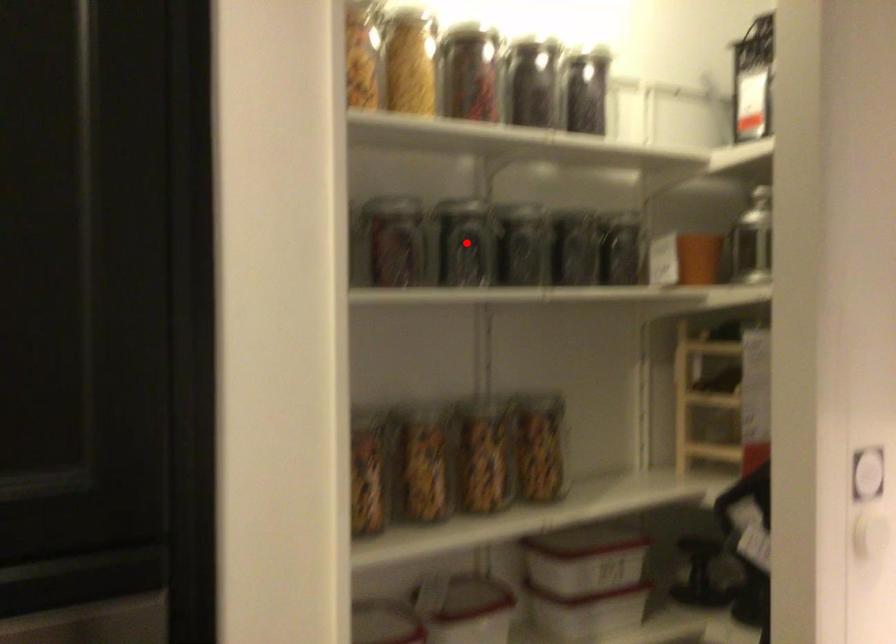
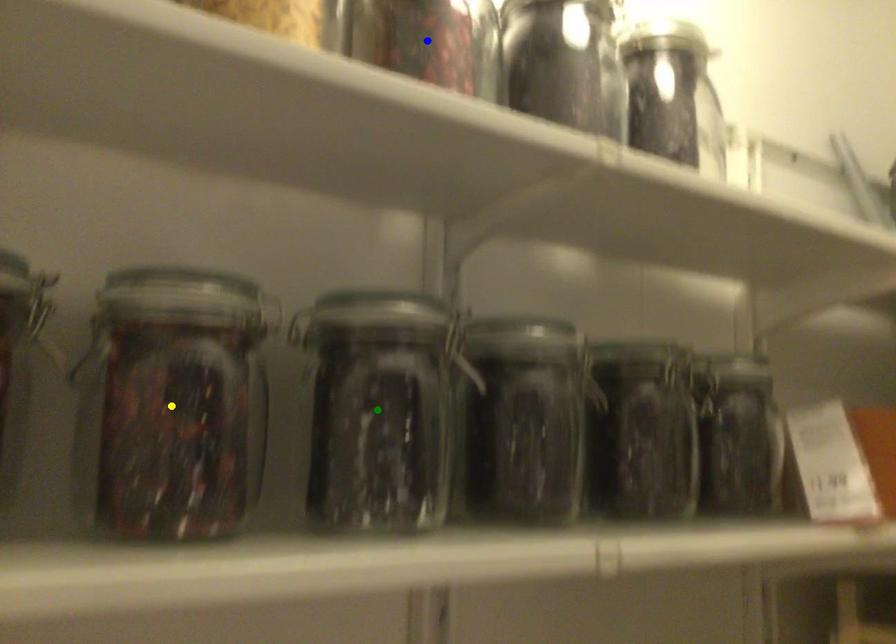
Question: I am providing you with two images of the same scene from different viewpoints. A red point is marked on the first image. You are given multiple points on the second image. Can you choose the point in image 2 that corresponds to the point in image 1?

Choices:
 (A) yellow point
 (B) blue point
 (C) green point

Answer: (C)